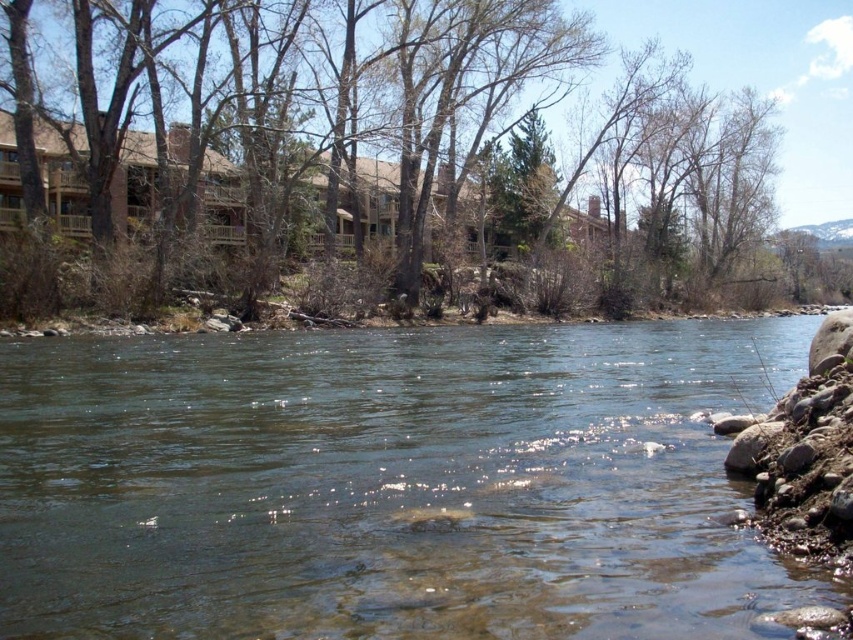
Which is below, clear water at center or brown wood tree at upper center?

clear water at center is below.

Measure the distance from clear water at center to brown wood tree at upper center.

clear water at center is 55.83 meters from brown wood tree at upper center.

The height and width of the screenshot is (640, 853). What are the coordinates of `clear water at center` in the screenshot? It's located at click(x=389, y=483).